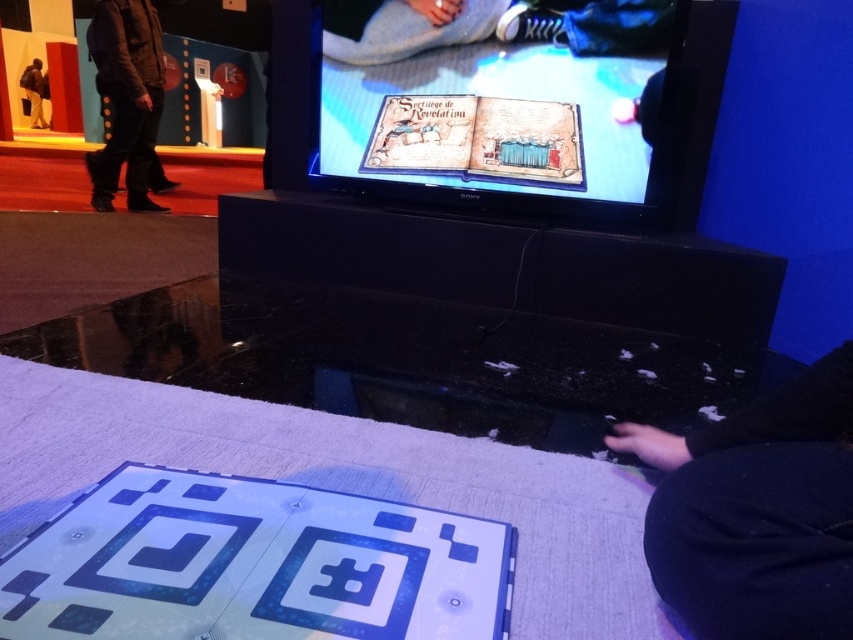
Question: Among these points, which one is farthest from the camera?

Choices:
 (A) (798, 540)
 (B) (35, 81)

Answer: (B)

Question: Which of the following is the farthest from the observer?

Choices:
 (A) black fabric pants at lower right
 (B) brown leather jacket at upper left
 (C) black suede boots at left

Answer: (B)

Question: Is black fabric pants at lower right positioned before black suede boots at left?

Choices:
 (A) no
 (B) yes

Answer: (B)

Question: Which of the following is the farthest from the observer?

Choices:
 (A) (827, 529)
 (B) (41, 97)
 (C) (146, 8)

Answer: (B)

Question: Can you confirm if black fabric pants at lower right is bigger than brown leather jacket at upper left?

Choices:
 (A) yes
 (B) no

Answer: (B)

Question: In this image, where is black fabric pants at lower right located relative to brown leather jacket at upper left?

Choices:
 (A) right
 (B) left

Answer: (A)